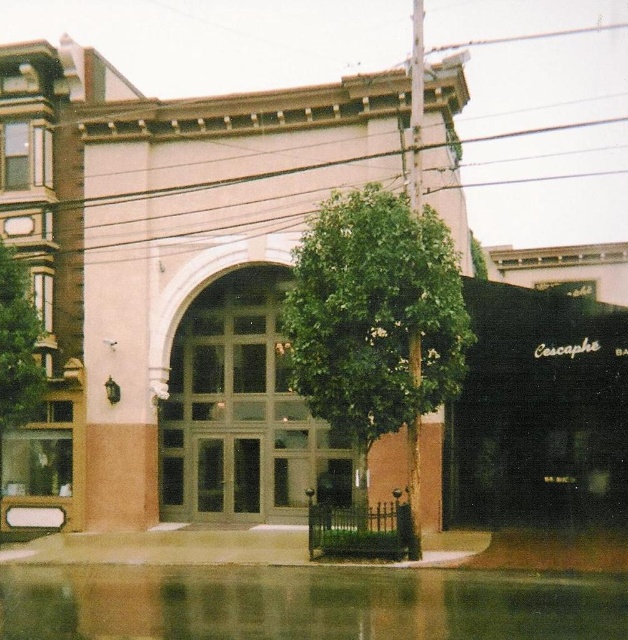
Question: Can you confirm if green leafy tree at center is positioned above green leafy tree at left?

Choices:
 (A) no
 (B) yes

Answer: (B)

Question: Can you confirm if green leafy tree at center is smaller than green leafy tree at left?

Choices:
 (A) yes
 (B) no

Answer: (B)

Question: Can you confirm if green leafy tree at center is positioned to the left of green leafy tree at left?

Choices:
 (A) yes
 (B) no

Answer: (B)

Question: Among these objects, which one is nearest to the camera?

Choices:
 (A) green leafy tree at center
 (B) green leafy tree at left

Answer: (A)

Question: Which point is farther from the camera taking this photo?

Choices:
 (A) (11, 266)
 (B) (374, 403)

Answer: (A)